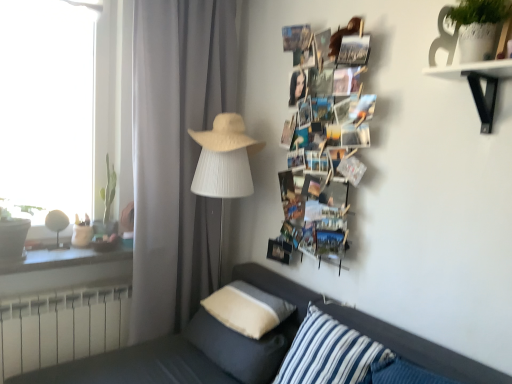
Where is `vacant region below printed paper collage at upper right (from a real-world perspective)`? This screenshot has height=384, width=512. vacant region below printed paper collage at upper right (from a real-world perspective) is located at coordinates (302, 287).